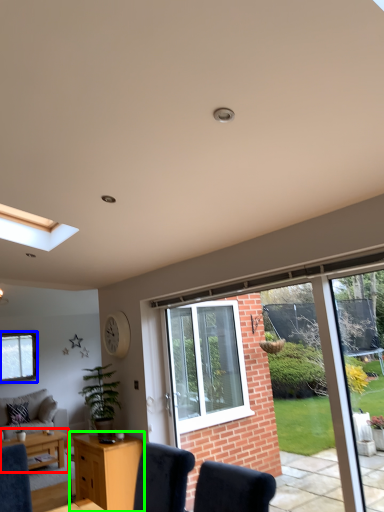
Question: Estimate the real-world distances between objects in this image. Which object is closer to table (highlighted by a red box), window (highlighted by a blue box) or desk (highlighted by a green box)?

Choices:
 (A) window
 (B) desk

Answer: (B)